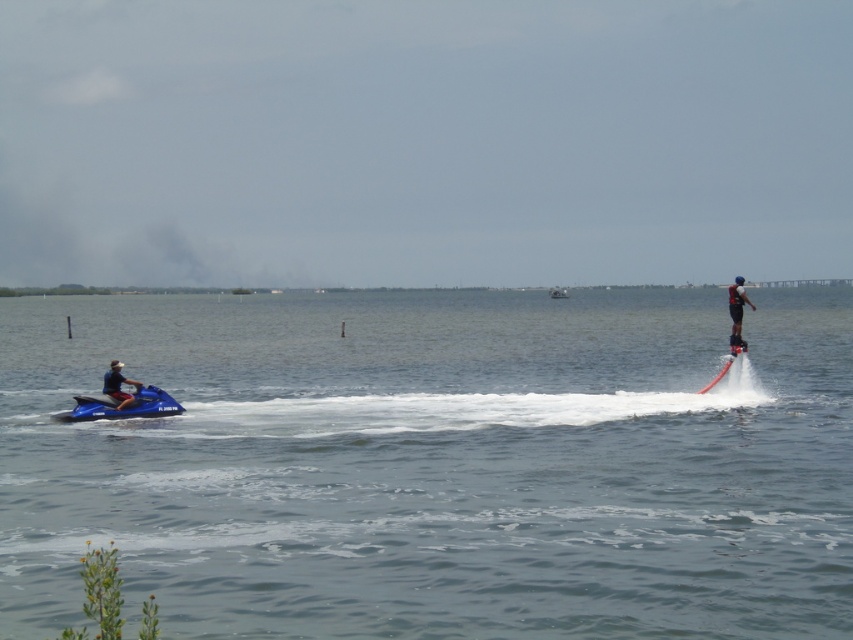
Does point (122, 392) lie in front of point (555, 285)?

That is True.

You are a GUI agent. You are given a task and a screenshot of the screen. Output one action in this format:
    pyautogui.click(x=<x>, y=<y>)
    Task: Click on the matte black jet ski at left
    
    Given the screenshot: What is the action you would take?
    pyautogui.click(x=117, y=385)

Who is shorter, clear water at jet ski left or red matte water ski at right?

red matte water ski at right

Is clear water at jet ski left positioned behind red matte water ski at right?

That is False.

The image size is (853, 640). Identify the location of clear water at jet ski left. (436, 465).

The width and height of the screenshot is (853, 640). Identify the location of clear water at jet ski left. (436, 465).

Is blue matte jet ski at left to the left of white plastic boat at center from the viewer's perspective?

Indeed, blue matte jet ski at left is positioned on the left side of white plastic boat at center.

Image resolution: width=853 pixels, height=640 pixels. What do you see at coordinates (120, 408) in the screenshot?
I see `blue matte jet ski at left` at bounding box center [120, 408].

At what (x,y) coordinates should I click in order to perform the action: click on blue matte jet ski at left. Please return your answer as a coordinate pair (x, y). Looking at the image, I should click on (120, 408).